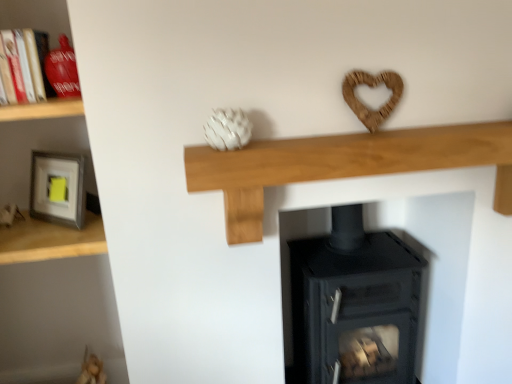
Locate an element on the screen. free space above matte gray frame at left, arranged as the third shelf when viewed from the right (from a real-world perspective) is located at coordinates (41, 225).